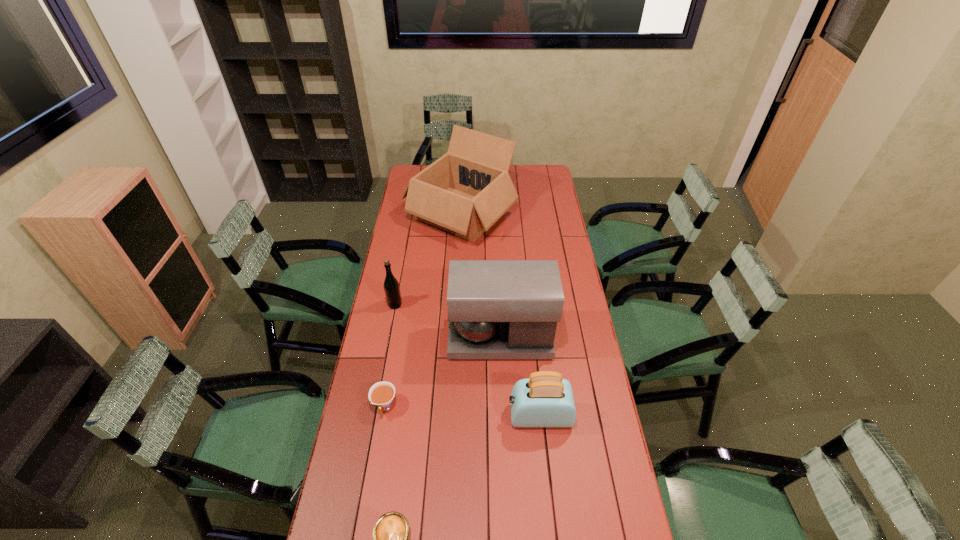
Find the location of a particular element. the farthest object is located at coordinates (464, 192).

The height and width of the screenshot is (540, 960). Identify the location of the fourth nearest object. (497, 309).

The width and height of the screenshot is (960, 540). I want to click on the second farthest object, so click(391, 286).

Find the location of `toaster`. toaster is located at coordinates (545, 399).

This screenshot has width=960, height=540. What are the coordinates of `teacup` in the screenshot? It's located at (381, 394).

Where is `vacant space located 0.320m on the front of the farthest object`? The image size is (960, 540). vacant space located 0.320m on the front of the farthest object is located at coordinates (456, 297).

Identify the location of blank space located 0.270m on the carafe side of the third farthest object. The image size is (960, 540). (382, 339).

Locate an element on the screen. This screenshot has width=960, height=540. vacant space located 0.050m on the carafe side of the third farthest object is located at coordinates pos(437,339).

The width and height of the screenshot is (960, 540). I want to click on free space located on the carafe side of the third farthest object, so click(420, 339).

Image resolution: width=960 pixels, height=540 pixels. Identify the location of free space located on the back of the second farthest object. (400, 276).